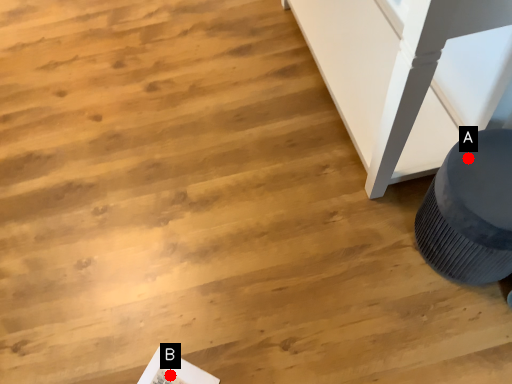
Question: Two points are circled on the image, labeled by A and B beside each circle. Which point is further to the camera?

Choices:
 (A) A is further
 (B) B is further

Answer: (B)